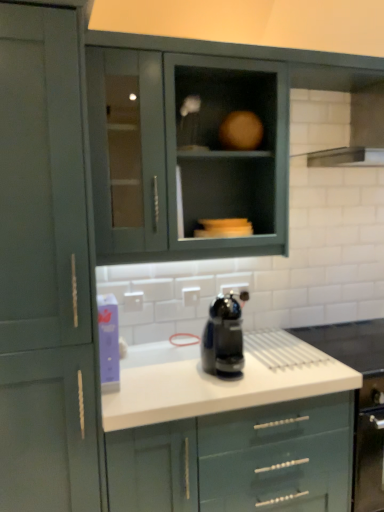
Locate an element on the screen. vacant space underneath black glossy coffee maker at center (from a real-world perspective) is located at coordinates (246, 373).